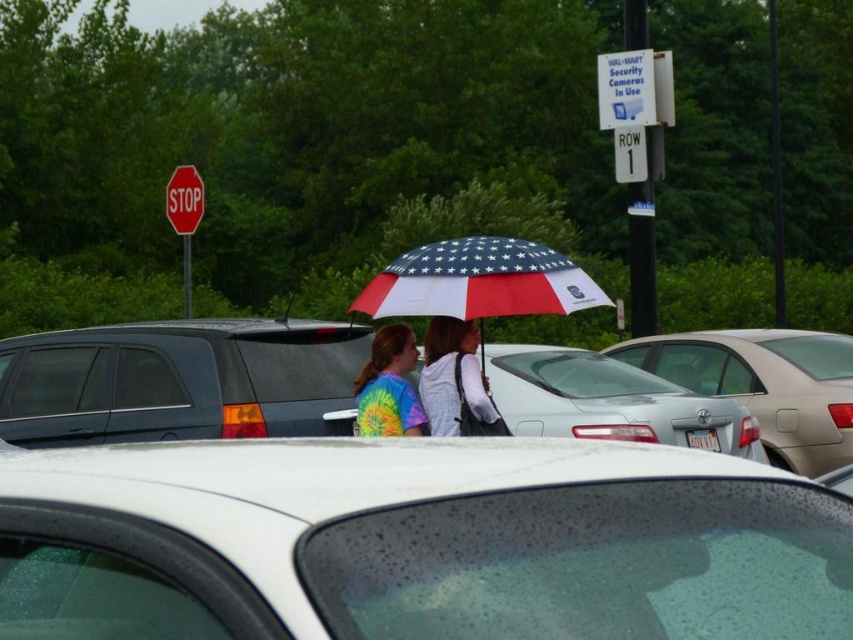
Question: Estimate the real-world distances between objects in this image. Which object is farther from the silver metallic sedan at center?

Choices:
 (A) white matte car at center
 (B) matte white hoodie at center
 (C) red matte stop sign at upper left
 (D) silver metallic sedan at center-right

Answer: (C)

Question: Can you confirm if american flag-patterned umbrella at center is thinner than red matte stop sign at upper left?

Choices:
 (A) no
 (B) yes

Answer: (B)

Question: Which point appears closest to the camera in this image?

Choices:
 (A) (822, 385)
 (B) (375, 424)
 (C) (676, 440)
 (D) (199, 180)

Answer: (B)

Question: Which object is closer to the camera taking this photo?

Choices:
 (A) american flag-patterned umbrella at center
 (B) silver metallic sedan at center

Answer: (A)

Question: Does white matte car at center appear on the right side of silver metallic sedan at center?

Choices:
 (A) no
 (B) yes

Answer: (A)

Question: Observing the image, what is the correct spatial positioning of white matte car at center in reference to matte white hoodie at center?

Choices:
 (A) right
 (B) left

Answer: (A)